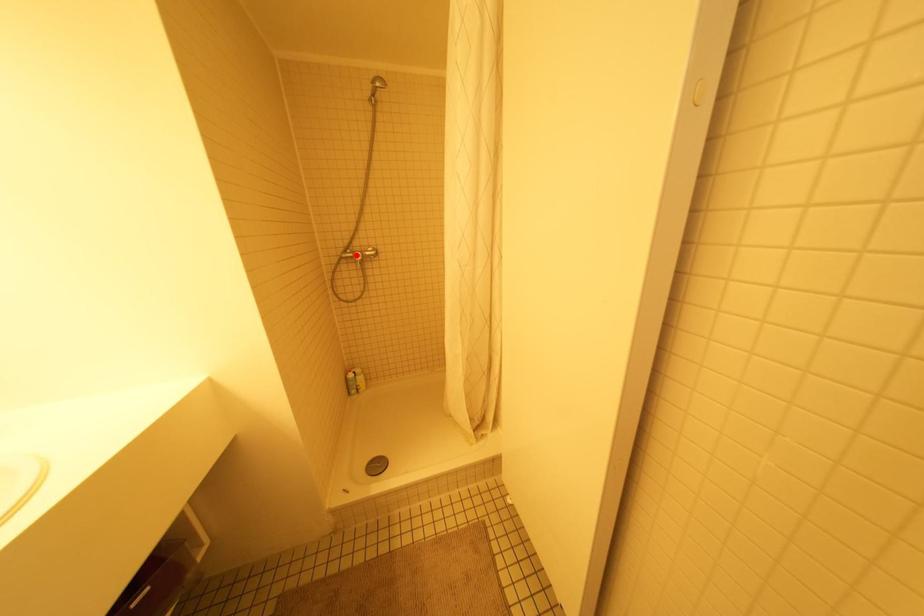
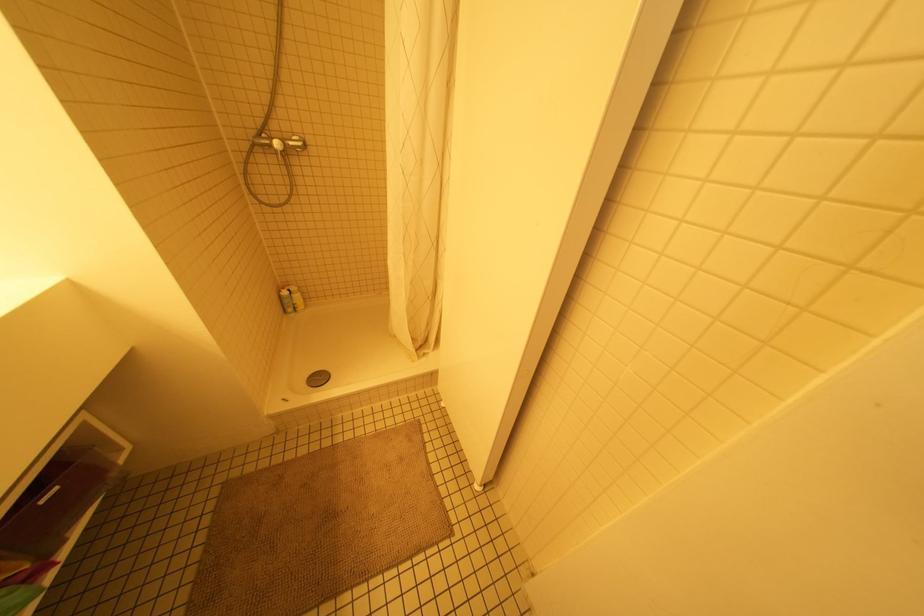
Find the pixel in the second image that matches the highlighted location in the first image.

(276, 144)